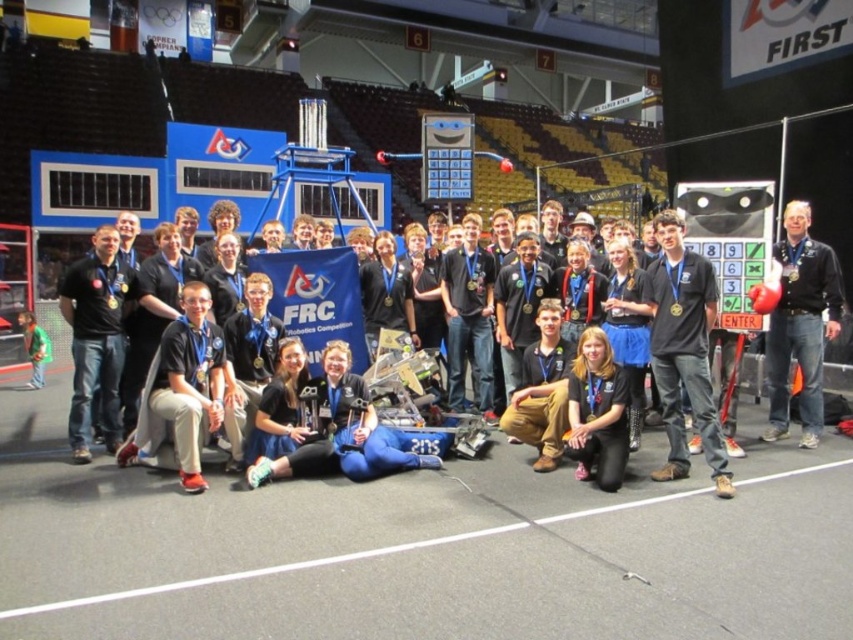
You are a photographer at the event and need to adjust the camera focus. The black matte shirt at center and the green fabric shirt at lower left are in your frame. Which shirt should you focus on first if you want to ensure the taller one is sharp?

The black matte shirt at center is taller than the green fabric shirt at lower left, so focus on the black matte shirt at center first to ensure it is sharp.

You are a photographer at the event and need to ensure that both the black matte shirt at center and the green fabric shirt at lower left are visible in the photo. Based on their positions, which shirt should you focus on first to capture both in the frame?

The black matte shirt at center is located above the green fabric shirt at lower left, so focusing on the black matte shirt at center first will ensure both are visible in the frame.